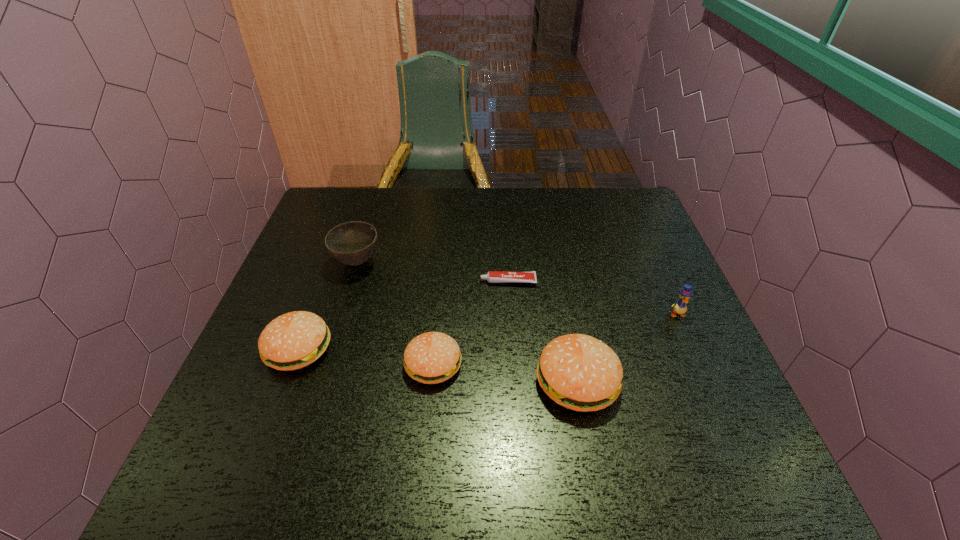
I want to click on object that is at the right edge, so click(x=679, y=307).

The width and height of the screenshot is (960, 540). What are the coordinates of `vacant space at the far edge of the desktop` in the screenshot? It's located at (456, 222).

Where is `vacant space at the left edge of the desktop`? This screenshot has height=540, width=960. vacant space at the left edge of the desktop is located at coordinates (340, 299).

In the image, there is a desktop. Where is `vacant space at the right edge`? Image resolution: width=960 pixels, height=540 pixels. vacant space at the right edge is located at coordinates (619, 234).

Where is `vacant space at the far left corner of the desktop`? This screenshot has width=960, height=540. vacant space at the far left corner of the desktop is located at coordinates (339, 197).

This screenshot has width=960, height=540. In the image, there is a desktop. Identify the location of vacant space at the near left corner. (265, 434).

Identify the location of free location at the far right corner of the desktop. This screenshot has width=960, height=540. (634, 202).

The image size is (960, 540). In order to click on empty space that is in between the rightmost patty and the rightmost object in this screenshot , I will do `click(627, 347)`.

Where is `free space between the rightmost object and the fourth tallest object`? The height and width of the screenshot is (540, 960). free space between the rightmost object and the fourth tallest object is located at coordinates (488, 331).

The image size is (960, 540). I want to click on free point between the fifth tallest object and the toothpaste, so click(x=470, y=323).